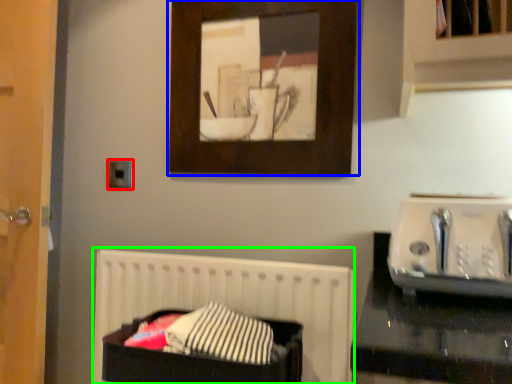
Question: Estimate the real-world distances between objects in this image. Which object is closer to electric outlet (highlighted by a red box), picture frame (highlighted by a blue box) or bed (highlighted by a green box)?

Choices:
 (A) picture frame
 (B) bed

Answer: (B)